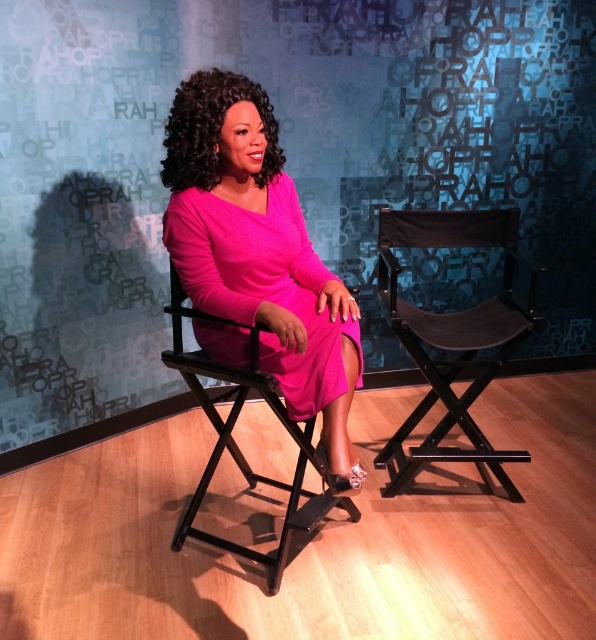
Consider the image. You are standing in front of the scene and want to determine which of the two points, point (212,260) or point (265,566), is closer to you. Based on the description, which point is nearer?

Point (212,260) is closer to the camera than point (265,566), so it is the nearer point.

You are a photographer setting up for a photoshoot. You have a camera that can focus on objects within 3 feet. You see the textured fabric backdrop at upper center and the pink satin dress at center. Can your camera focus on both objects at the same time?

The distance between the textured fabric backdrop at upper center and the pink satin dress at center is 3.41 feet. Since your camera can focus within 3 feet, it cannot focus on both objects simultaneously because they are beyond the 3 feet range.